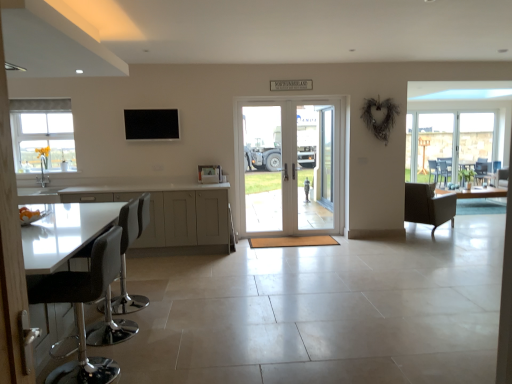
Locate an element on the screen. The image size is (512, 384). spots to the right of black leather stool at lower left, the 3th chair when ordered from back to front is located at coordinates (156, 362).